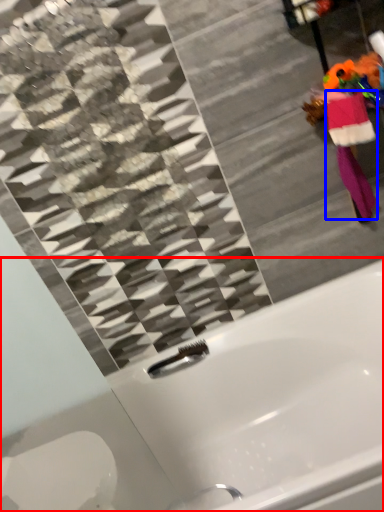
Question: Which of the following is the farthest to the observer, bathtub (highlighted by a red box) or robe (highlighted by a blue box)?

Choices:
 (A) bathtub
 (B) robe

Answer: (B)